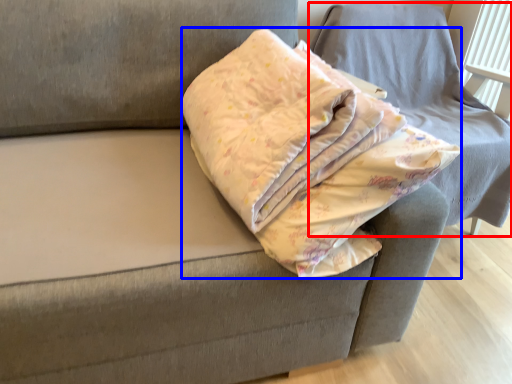
Question: Which object appears farthest to the camera in this image, furniture (highlighted by a red box) or throw pillow (highlighted by a blue box)?

Choices:
 (A) furniture
 (B) throw pillow

Answer: (A)